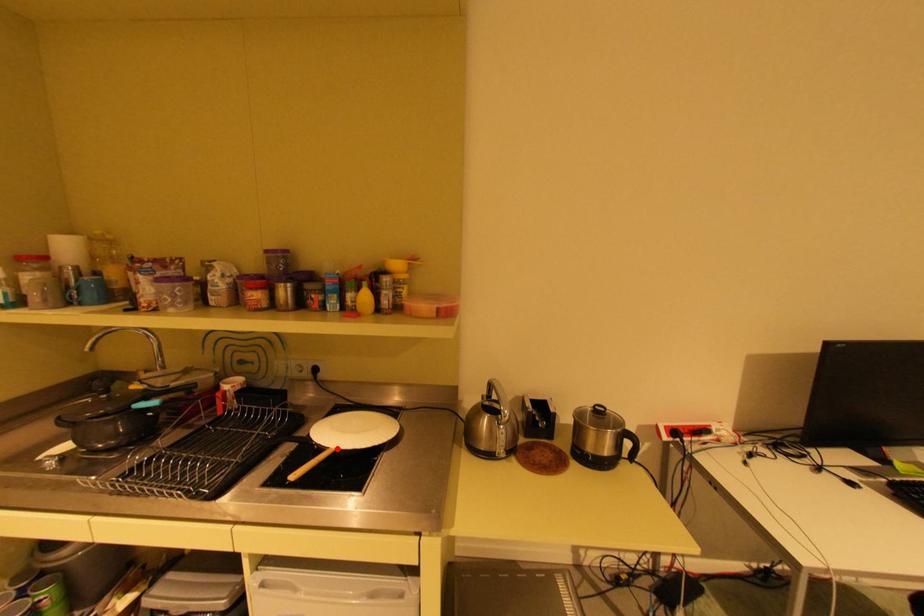
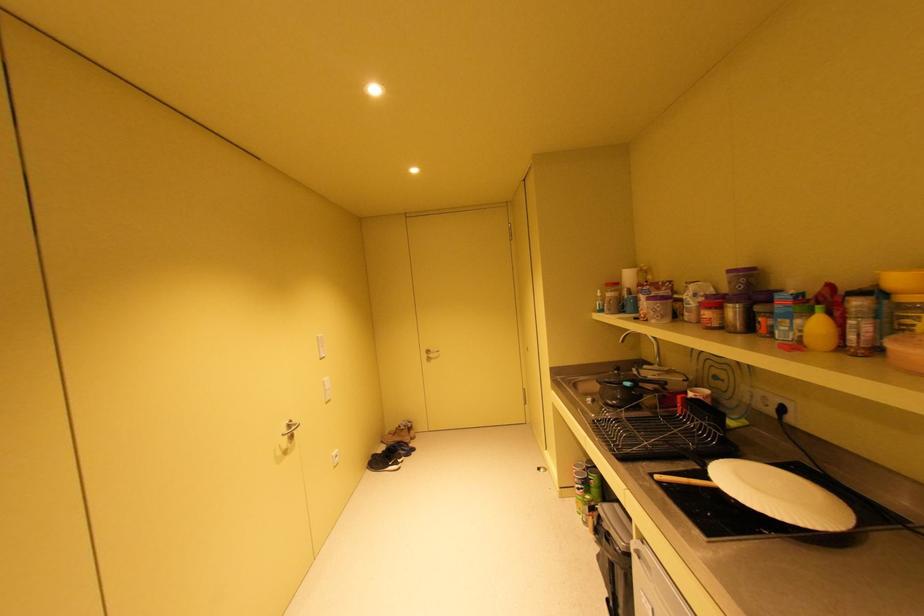
Where in the second image is the point corresponding to the highlighted location from the first image?

(721, 482)